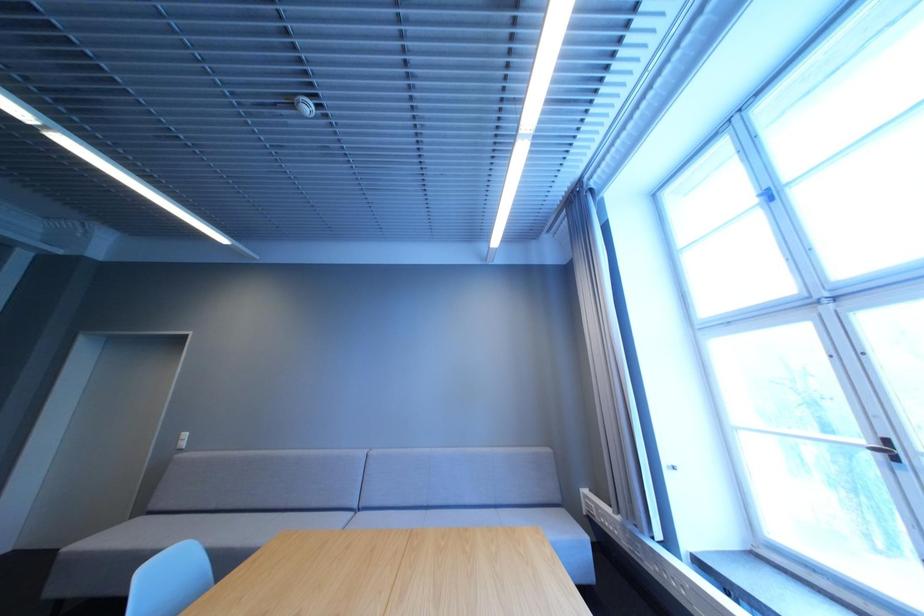
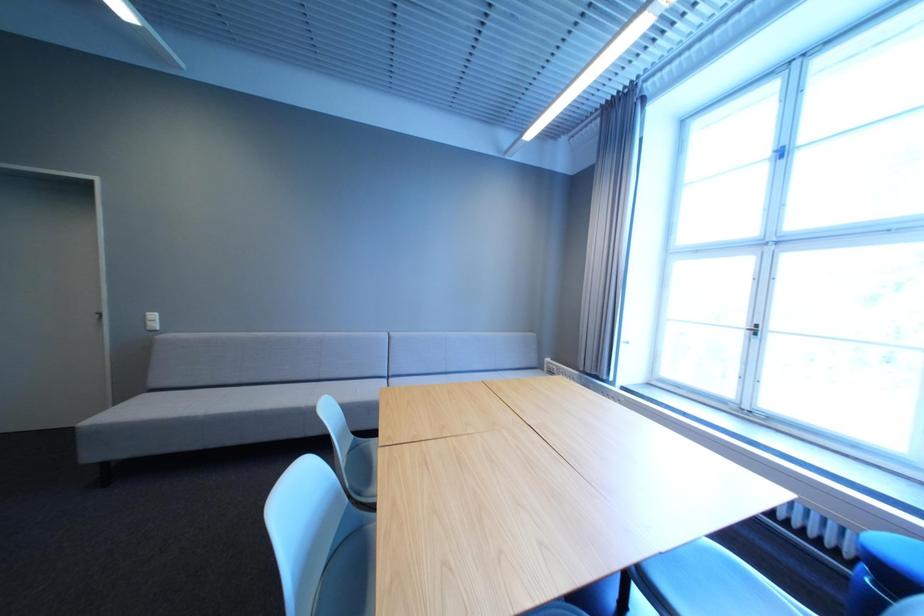
Question: The images are taken continuously from a first-person perspective. In which direction are you moving?

Choices:
 (A) Left
 (B) Right
 (C) Forward
 (D) Backward

Answer: (A)